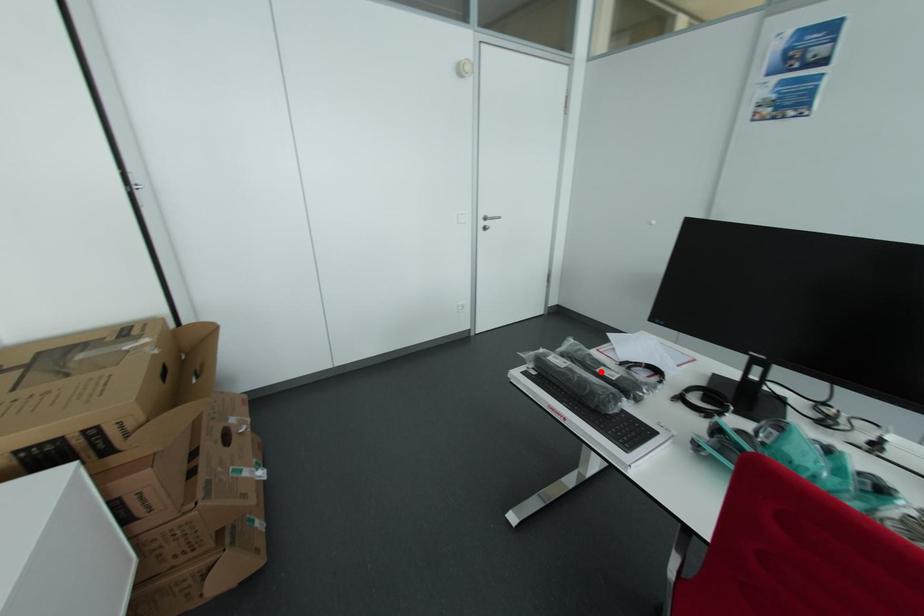
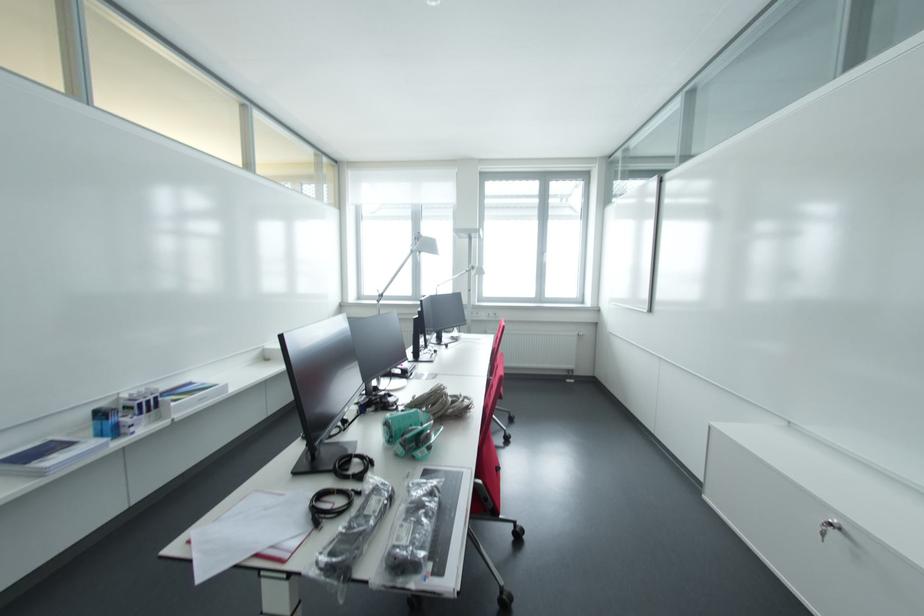
Locate, in the second image, the point that corresponds to the highlighted location in the first image.

(380, 516)